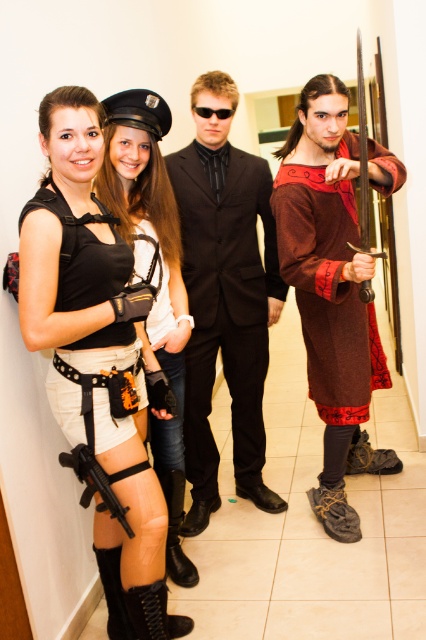
Question: Among these objects, which one is farthest from the camera?

Choices:
 (A) black plastic goggles at center
 (B) matte black vest at left
 (C) brown woven fabric tunic at right

Answer: (A)

Question: Can you confirm if black satin suit at center is positioned above brown woven fabric tunic at right?

Choices:
 (A) no
 (B) yes

Answer: (A)

Question: Is the position of matte black vest at left less distant than that of black plastic goggles at center?

Choices:
 (A) no
 (B) yes

Answer: (B)

Question: Which is nearer to the black leather shorts at lower left?

Choices:
 (A) brown woven fabric tunic at right
 (B) black plastic goggles at center
 (C) matte black vest at left

Answer: (C)

Question: Where is brown woven fabric tunic at right located in relation to black plastic goggles at center in the image?

Choices:
 (A) below
 (B) above

Answer: (A)

Question: Which point is closer to the camera taking this photo?

Choices:
 (A) (192, 109)
 (B) (55, 152)
 (C) (385, 160)

Answer: (B)